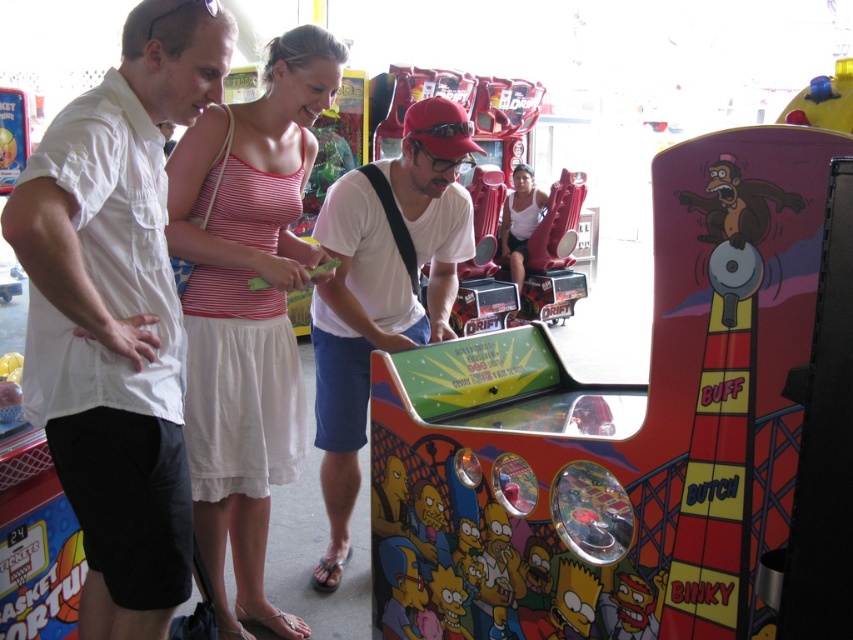
Question: Which object is farther from the camera taking this photo?

Choices:
 (A) white matte shirt at center
 (B) white cotton dress at center

Answer: (B)

Question: Which of the following is the farthest from the observer?

Choices:
 (A) white matte shirt at center
 (B) white cotton dress at center

Answer: (B)

Question: Can you confirm if white cotton shirt at upper left is bigger than white cotton dress at center?

Choices:
 (A) no
 (B) yes

Answer: (A)

Question: Can you confirm if white cotton dress at center is positioned to the left of white matte shirt at center?

Choices:
 (A) no
 (B) yes

Answer: (B)

Question: Which of the following is the closest to the observer?

Choices:
 (A) (451, 132)
 (B) (262, 170)

Answer: (B)

Question: Does white cotton shirt at upper left have a larger size compared to white matte shirt at center?

Choices:
 (A) yes
 (B) no

Answer: (B)